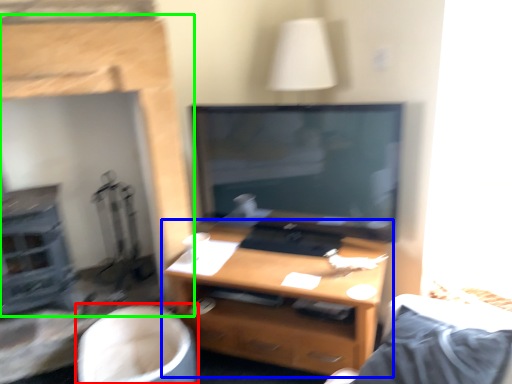
Question: Considering the real-world distances, which object is closest to swivel chair (highlighted by a red box)? desk (highlighted by a blue box) or fireplace (highlighted by a green box).

Choices:
 (A) desk
 (B) fireplace

Answer: (A)